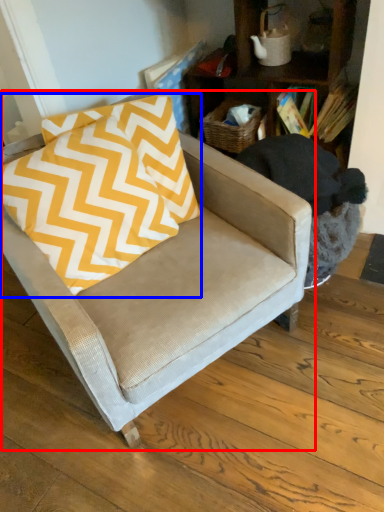
Question: Among these objects, which one is farthest to the camera, chair (highlighted by a red box) or pillow (highlighted by a blue box)?

Choices:
 (A) chair
 (B) pillow

Answer: (B)